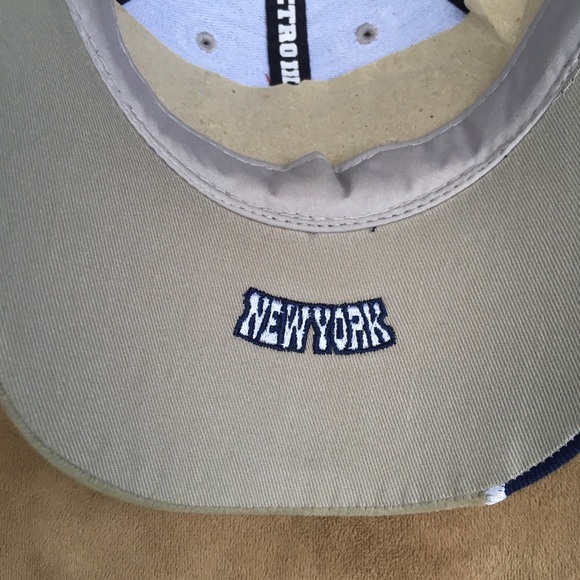
The width and height of the screenshot is (580, 580). Find the location of `cardboard stiffener inside ballcap`. cardboard stiffener inside ballcap is located at coordinates (344, 112).